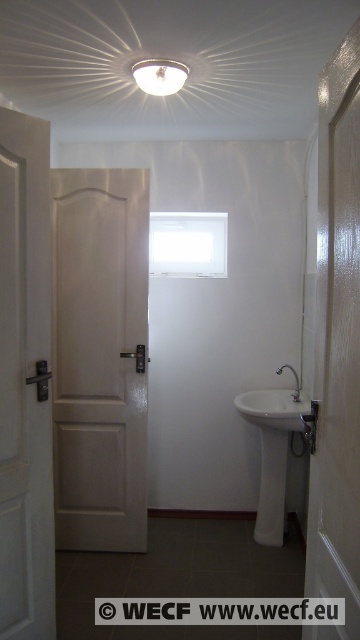
Which is behind, point (105, 221) or point (2, 147)?

Point (105, 221)

Where is `white glossy door at center`? white glossy door at center is located at coordinates (100, 356).

Is point (97, 454) positioned behind point (1, 548)?

Yes, it is behind point (1, 548).

Identify the location of white glossy door at center. (100, 356).

Looking at this image, measure the distance from white matte door at left to matte silver faucet at center right.

white matte door at left is 6.10 feet away from matte silver faucet at center right.

Does white matte door at left appear on the left side of matte silver faucet at center right?

Correct, you'll find white matte door at left to the left of matte silver faucet at center right.

Who is more distant from viewer, (15, 362) or (279, 372)?

Point (279, 372)

At what (x,y) coordinates should I click in order to perform the action: click on white matte door at left. Please return your answer as a coordinate pair (x, y). Looking at the image, I should click on pyautogui.click(x=24, y=381).

Is white matte door at left positioned before matte white light fixture at upper center?

That is True.

Can you confirm if white matte door at left is positioned below matte white light fixture at upper center?

Yes, white matte door at left is below matte white light fixture at upper center.

Is point (27, 330) positioned after point (173, 81)?

No, it is in front of (173, 81).

This screenshot has width=360, height=640. In order to click on white matte door at left in this screenshot , I will do `click(24, 381)`.